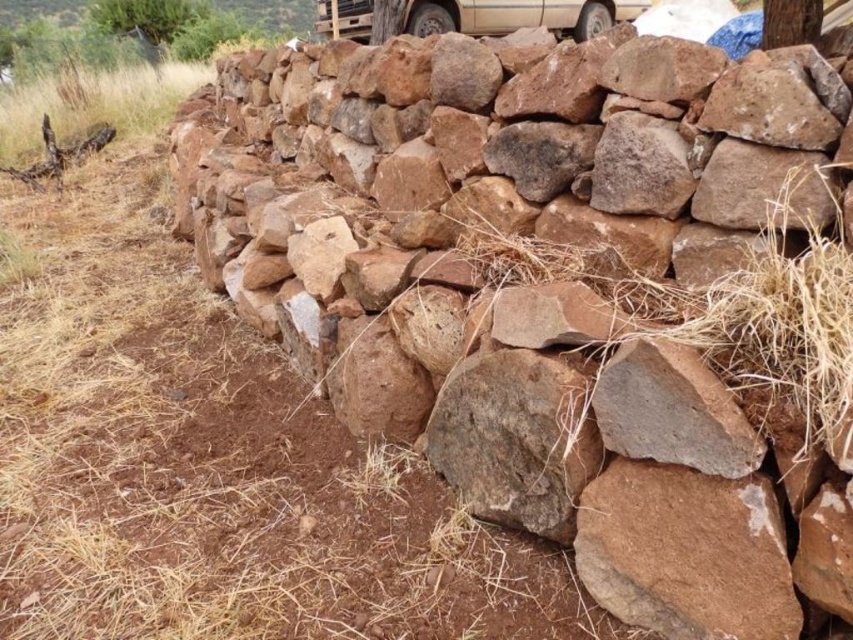
Question: Can you confirm if beige matte truck at upper center is thinner than brown rough tree trunk at upper right?

Choices:
 (A) yes
 (B) no

Answer: (B)

Question: Which object appears farthest from the camera in this image?

Choices:
 (A) brown rough tree trunk at upper right
 (B) beige matte truck at upper center

Answer: (B)

Question: Which of the following is the farthest from the observer?

Choices:
 (A) (595, 19)
 (B) (821, 4)

Answer: (A)

Question: Where is beige matte truck at upper center located in relation to brown rough tree trunk at upper right in the image?

Choices:
 (A) below
 (B) above

Answer: (B)

Question: Can you confirm if beige matte truck at upper center is positioned to the left of brown rough tree trunk at upper right?

Choices:
 (A) yes
 (B) no

Answer: (A)

Question: Which of the following is the farthest from the observer?

Choices:
 (A) beige matte truck at upper center
 (B) brown rough tree trunk at upper right

Answer: (A)